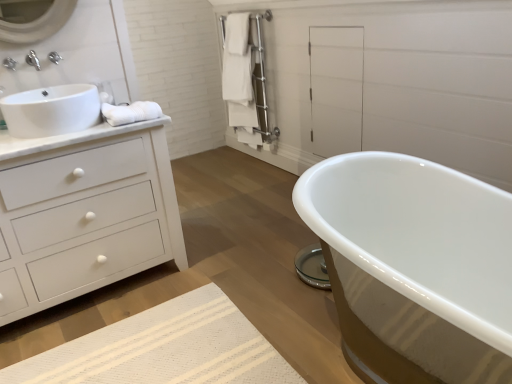
Question: Considering the relative sizes of brushed metal faucet at upper left and satin nickel towel rack at upper center in the image provided, is brushed metal faucet at upper left shorter than satin nickel towel rack at upper center?

Choices:
 (A) no
 (B) yes

Answer: (B)

Question: Is brushed metal faucet at upper left taller than satin nickel towel rack at upper center?

Choices:
 (A) yes
 (B) no

Answer: (B)

Question: From a real-world perspective, is brushed metal faucet at upper left located beneath satin nickel towel rack at upper center?

Choices:
 (A) no
 (B) yes

Answer: (A)

Question: Is brushed metal faucet at upper left positioned with its back to satin nickel towel rack at upper center?

Choices:
 (A) yes
 (B) no

Answer: (B)

Question: Is brushed metal faucet at upper left behind satin nickel towel rack at upper center?

Choices:
 (A) yes
 (B) no

Answer: (B)

Question: Does brushed metal faucet at upper left appear on the right side of satin nickel towel rack at upper center?

Choices:
 (A) no
 (B) yes

Answer: (A)

Question: Is brushed metal faucet at upper left taller than white matte cabinet at upper center?

Choices:
 (A) no
 (B) yes

Answer: (A)

Question: Can white matte cabinet at upper center be found inside brushed metal faucet at upper left?

Choices:
 (A) no
 (B) yes

Answer: (A)

Question: Is brushed metal faucet at upper left not close to white matte cabinet at upper center?

Choices:
 (A) no
 (B) yes

Answer: (B)

Question: Is brushed metal faucet at upper left looking in the opposite direction of white matte cabinet at upper center?

Choices:
 (A) no
 (B) yes

Answer: (A)

Question: Does brushed metal faucet at upper left have a greater width compared to white matte cabinet at upper center?

Choices:
 (A) yes
 (B) no

Answer: (A)

Question: Considering the relative sizes of brushed metal faucet at upper left and white matte cabinet at upper center in the image provided, is brushed metal faucet at upper left shorter than white matte cabinet at upper center?

Choices:
 (A) no
 (B) yes

Answer: (B)

Question: Considering the relative sizes of satin nickel towel rack at upper center and white glossy sink at left in the image provided, is satin nickel towel rack at upper center taller than white glossy sink at left?

Choices:
 (A) no
 (B) yes

Answer: (B)